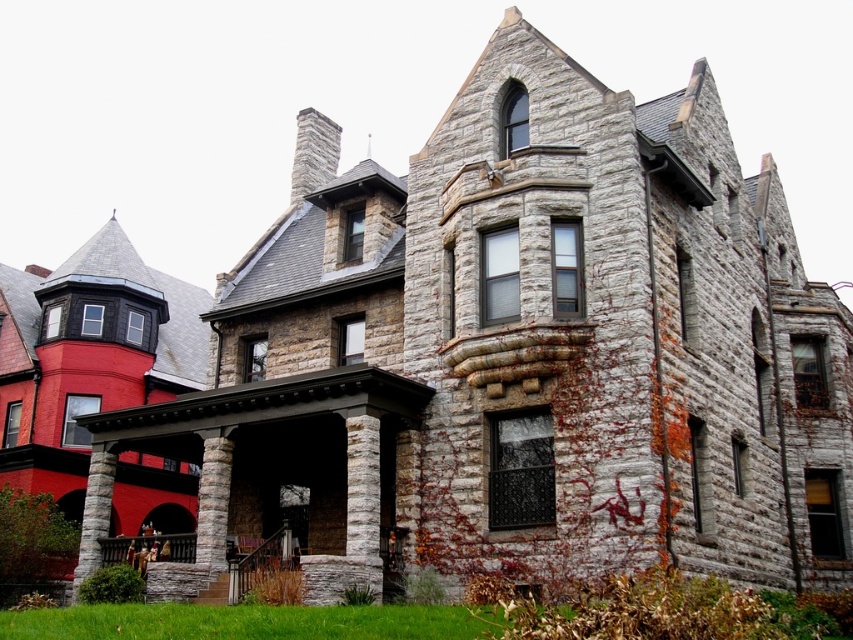
You are a delivery person carrying a package that requires a 5.5 meter clearance to maneuver safely. You need to pass between the stone porch at lower center and the gray stone column at lower left. Is there enough space for your delivery vehicle to pass through safely?

The distance between the stone porch at lower center and the gray stone column at lower left is 5.13 meters. Since the required clearance is 5.5 meters, the space is insufficient for the delivery vehicle to pass safely.

You are standing in front of the grand Victorian house and want to determine the relative positions of two points marked on the structure. Which point, point (x=225, y=531) or point (x=97, y=566), is closer to you?

Point (x=225, y=531) is closer to the viewer than point (x=97, y=566).